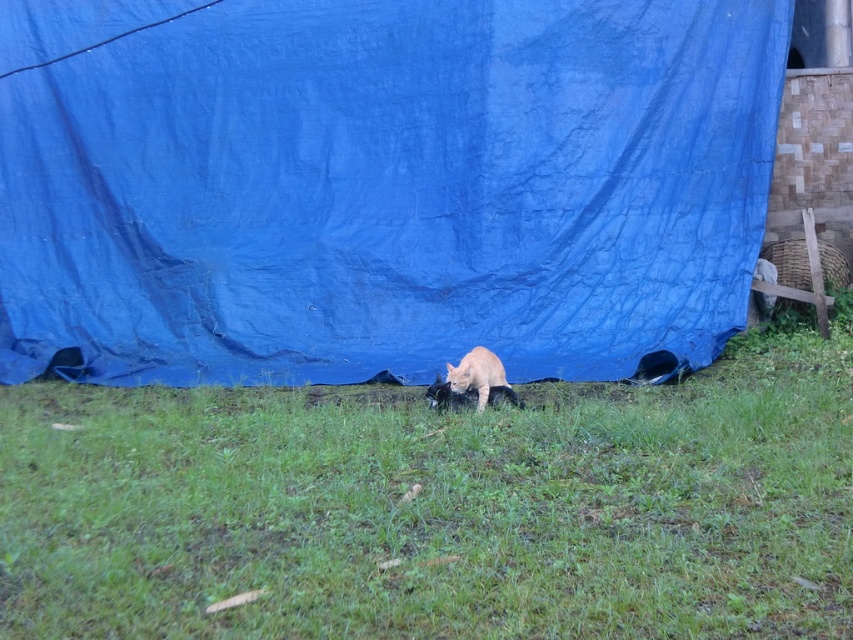
How much distance is there between blue tarpaulin at center and green grass at center?

blue tarpaulin at center and green grass at center are 3.34 meters apart from each other.

Does point (407, 76) come behind point (442, 625)?

Yes, it is.

Where is `blue tarpaulin at center`? blue tarpaulin at center is located at coordinates (379, 184).

Is point (608, 13) more distant than point (496, 378)?

That is True.

Is point (677, 52) in front of point (474, 376)?

No, it is behind (474, 376).

Is point (490, 106) closer to viewer compared to point (479, 401)?

No, (490, 106) is behind (479, 401).

You are a GUI agent. You are given a task and a screenshot of the screen. Output one action in this format:
    pyautogui.click(x=<x>, y=<y>)
    Task: Click on the blue tarpaulin at center
    This screenshot has height=640, width=853.
    Given the screenshot: What is the action you would take?
    pyautogui.click(x=379, y=184)

Who is positioned more to the right, green grass at center or orange fur cat at center?

From the viewer's perspective, orange fur cat at center appears more on the right side.

Does green grass at center lie in front of orange fur cat at center?

Yes, it is.

Is point (216, 419) more distant than point (477, 348)?

No, it is not.

The height and width of the screenshot is (640, 853). Find the location of `green grass at center`. green grass at center is located at coordinates (440, 506).